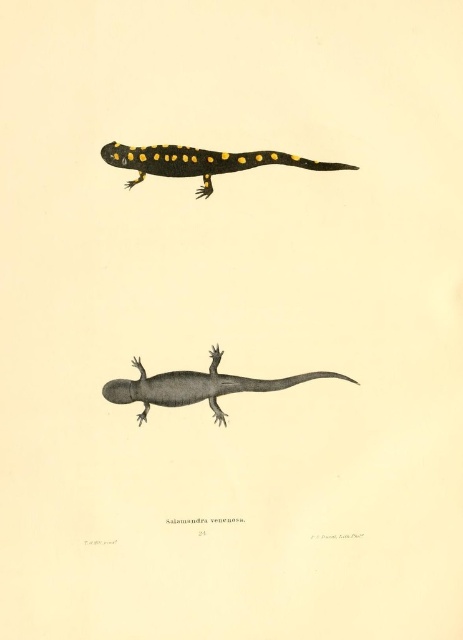
Between gray matte salamander at center and black glossy salamander at upper center, which one is positioned lower?

gray matte salamander at center

Which is behind, point (169, 376) or point (143, 154)?

Positioned behind is point (169, 376).

You are a GUI agent. You are given a task and a screenshot of the screen. Output one action in this format:
    pyautogui.click(x=<x>, y=<y>)
    Task: Click on the gray matte salamander at center
    
    Given the screenshot: What is the action you would take?
    pyautogui.click(x=196, y=387)